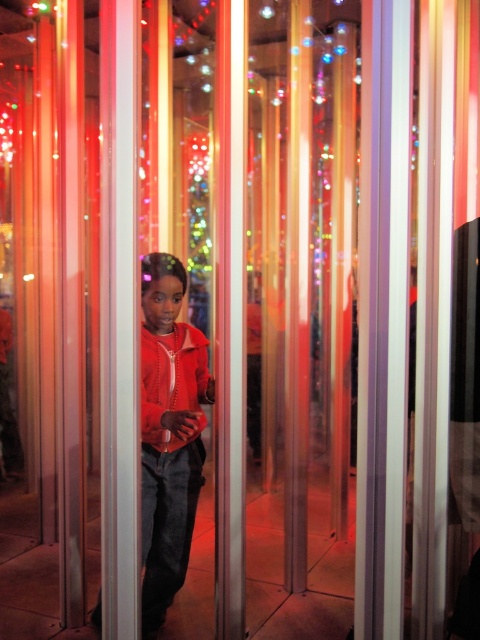
Does matte orange jacket at center appear under matte red sweatshirt at center?

Correct, matte orange jacket at center is located below matte red sweatshirt at center.

Is point (169, 339) positioned in front of point (167, 360)?

That is False.

Identify the location of matte orange jacket at center. This screenshot has height=640, width=480. (168, 433).